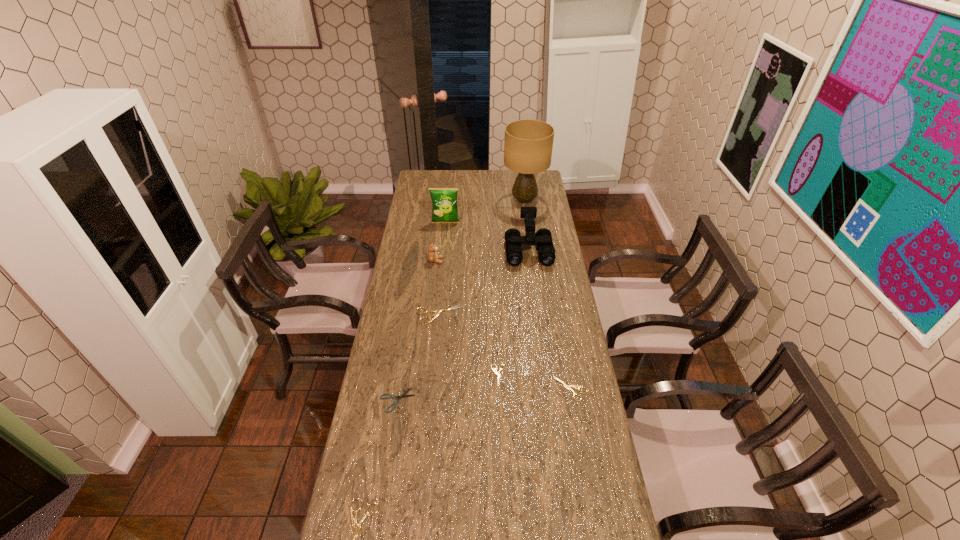
This screenshot has height=540, width=960. Find the location of `the sixth object from left to right`. the sixth object from left to right is located at coordinates (496, 373).

In order to click on the fourth shears from left to right in this screenshot , I will do `click(496, 373)`.

Find the location of `black shears`. black shears is located at coordinates (403, 395).

Image resolution: width=960 pixels, height=540 pixels. Identify the location of free space located 0.100m on the left of the beige lampshade. (484, 200).

The width and height of the screenshot is (960, 540). I want to click on free spot located 0.340m on the front-facing side of the crisp (potato chip), so click(x=441, y=271).

Find the location of a particular element. The height and width of the screenshot is (540, 960). vacant space located on the front lenses of the third tallest object is located at coordinates (539, 326).

Image resolution: width=960 pixels, height=540 pixels. Find the location of `free region located 0.080m on the front-facing side of the teddy bear`. free region located 0.080m on the front-facing side of the teddy bear is located at coordinates (461, 261).

Find the location of `free space located on the back of the farthest shears`. free space located on the back of the farthest shears is located at coordinates (444, 249).

You are a GUI agent. You are given a task and a screenshot of the screen. Output one action in this format:
    pyautogui.click(x=<x>, y=<y>)
    Task: Click on the vacant space situated on the back of the third shortest object
    The image size is (960, 540).
    Given the screenshot: What is the action you would take?
    pyautogui.click(x=564, y=352)

The height and width of the screenshot is (540, 960). I want to click on vacant space located 0.250m on the left of the fourth shears from left to right, so click(420, 375).